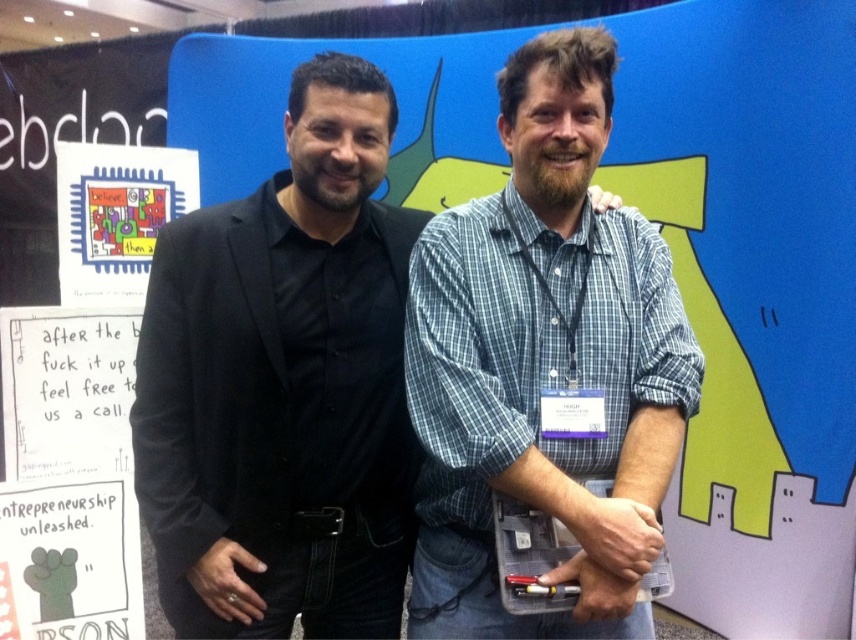
You are trying to decide which outfit to wear for a formal event. Given the image, which of the two outfits would be more appropriate for a formal event, the black matte suit at left or the blue plaid shirt at center?

The black matte suit at left is more appropriate for a formal event since it is a formal attire, while the blue plaid shirt at center is casual.

You are a photographer setting up for a group photo. You have a camera with a 10 inch wide lens. You need to position yourself so that both the black matte suit at left and the blue plaid shirt at center are fully visible in the frame. Can you fit both in the frame if you stand directly in front of them?

The black matte suit at left and blue plaid shirt at center are 11.61 inches apart. Since the lens is only 10 inches wide, you cannot fit both in the frame as the distance between them exceeds the lens width.